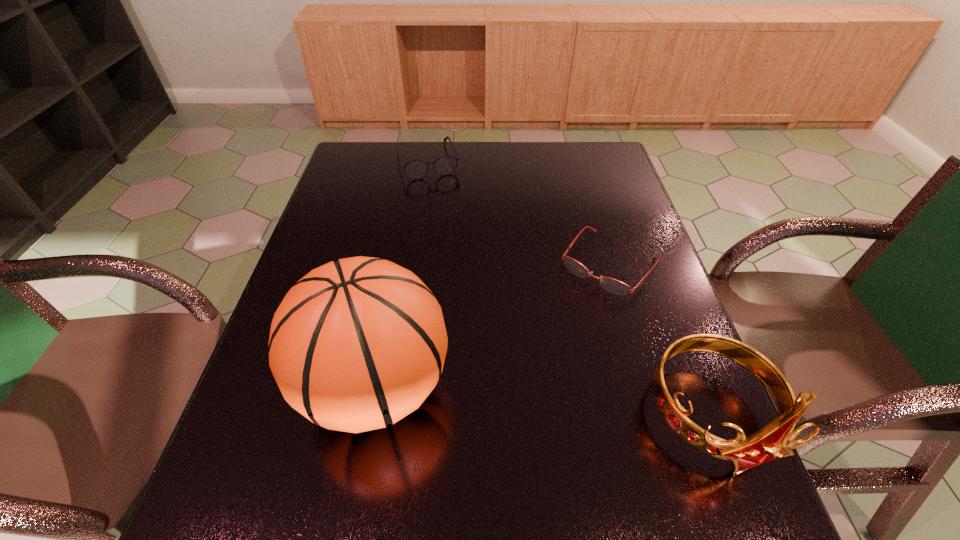
Locate an element on the screen. This screenshot has width=960, height=540. vacant space that is in between the tiara and the nearer spectacles is located at coordinates (660, 340).

Locate an element on the screen. vacant region between the tiara and the shorter spectacles is located at coordinates (660, 340).

Where is `free space between the tiara and the shortest object`? Image resolution: width=960 pixels, height=540 pixels. free space between the tiara and the shortest object is located at coordinates (660, 340).

This screenshot has height=540, width=960. Identify the location of free space between the taller spectacles and the right spectacles. (518, 212).

The height and width of the screenshot is (540, 960). I want to click on the third closest object to the basketball, so click(x=417, y=169).

Locate which object is the third closest to the tiara. Please provide its 2D coordinates. Your answer should be formatted as a tuple, i.e. [(x, y)], where the tuple contains the x and y coordinates of a point satisfying the conditions above.

[(417, 169)]